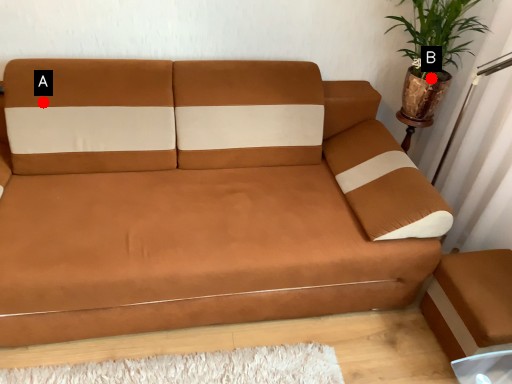
Question: Two points are circled on the image, labeled by A and B beside each circle. Which of the following is the closest to the observer?

Choices:
 (A) A is closer
 (B) B is closer

Answer: (A)